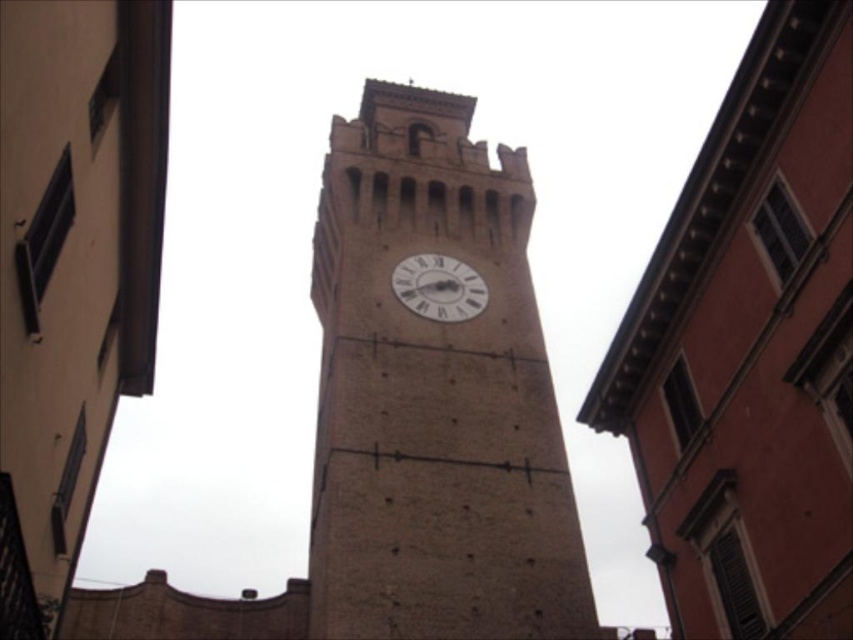
Question: Which point is farther to the camera?

Choices:
 (A) brown stone clock tower at center
 (B) white matte clock at center

Answer: (B)

Question: Does brown stone clock tower at center have a greater width compared to white matte clock at center?

Choices:
 (A) no
 (B) yes

Answer: (B)

Question: Does brown stone clock tower at center appear over white matte clock at center?

Choices:
 (A) no
 (B) yes

Answer: (A)

Question: Can you confirm if brown stone clock tower at center is bigger than white matte clock at center?

Choices:
 (A) yes
 (B) no

Answer: (A)